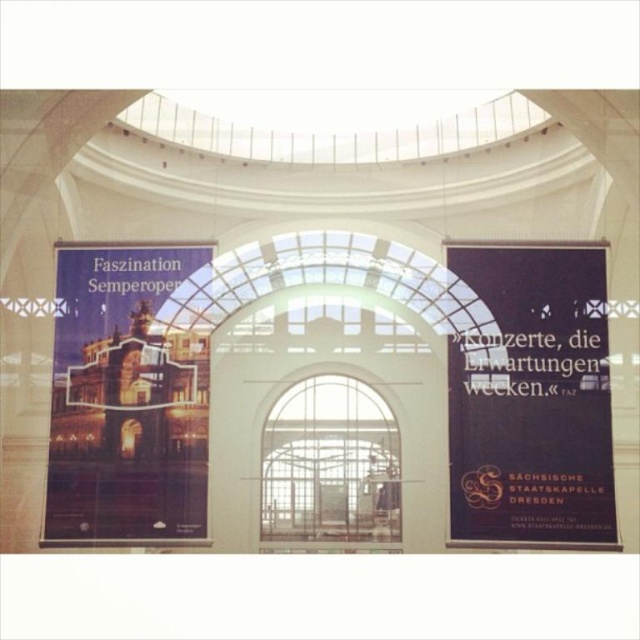
Question: Which point is closer to the camera taking this photo?

Choices:
 (A) (339, 412)
 (B) (163, 346)

Answer: (B)

Question: Which object appears farthest from the camera in this image?

Choices:
 (A) black paper poster at right
 (B) matte paper poster at left
 (C) clear glass window at center

Answer: (C)

Question: Is black paper poster at right smaller than clear glass window at center?

Choices:
 (A) no
 (B) yes

Answer: (A)

Question: Is matte paper poster at left wider than clear glass window at center?

Choices:
 (A) yes
 (B) no

Answer: (A)

Question: Which point appears closest to the camera in this image?

Choices:
 (A) (330, 513)
 (B) (124, 374)

Answer: (B)

Question: Is black paper poster at right in front of matte paper poster at left?

Choices:
 (A) yes
 (B) no

Answer: (A)